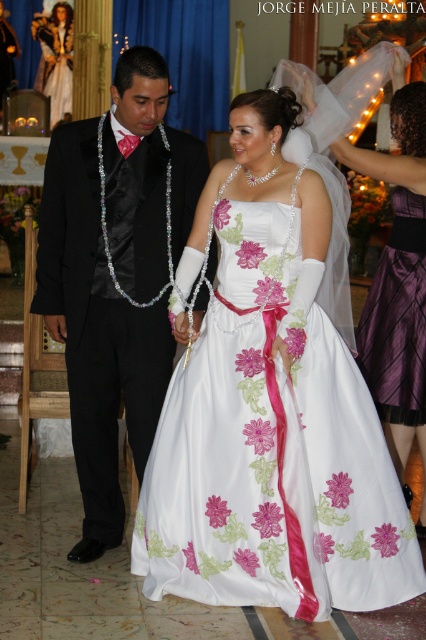
Who is shorter, black satin suit at left or white satin dress at center?

Standing shorter between the two is white satin dress at center.

Who is taller, black satin suit at left or white satin dress at center?

black satin suit at left is taller.

Is point (204, 173) positioned before point (417, 252)?

Yes, it is in front of point (417, 252).

You are a GUI agent. You are given a task and a screenshot of the screen. Output one action in this format:
    pyautogui.click(x=<x>, y=<y>)
    Task: Click on the black satin suit at left
    This screenshot has width=426, height=640.
    Given the screenshot: What is the action you would take?
    pyautogui.click(x=97, y=336)

Does satin floral dress at center have a larger size compared to purple satin skirt at lower right?

Yes.

From the picture: Who is more forward, (244,412) or (400,221)?

Point (244,412) is more forward.

Does point (164, 472) lie behind point (417, 380)?

No, it is in front of (417, 380).

At what (x,y) coordinates should I click in order to perform the action: click on satin floral dress at center. Please return your answer as a coordinate pair (x, y). Looking at the image, I should click on (270, 408).

Between white satin dress at center and purple satin skirt at lower right, which one has more height?

Standing taller between the two is white satin dress at center.

Is point (391, 440) positioned behind point (397, 264)?

Yes, it is behind point (397, 264).

Is point (411, 371) positioned behind point (393, 333)?

No, (411, 371) is in front of (393, 333).

I want to click on white satin dress at center, so click(397, 280).